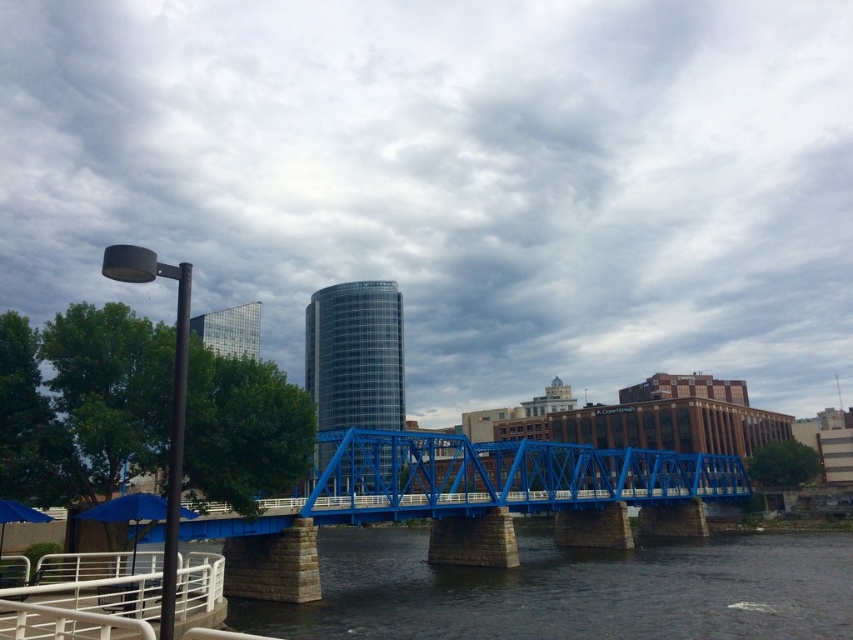
You are standing at the base of the blue truss bridge and want to take a photo. There are two points marked on the bridge structure at coordinates point (639,624) and point (469,467). Which point will appear larger in your photo?

Point (639,624) is closer to the camera than point (469,467), so it will appear larger in the photo.